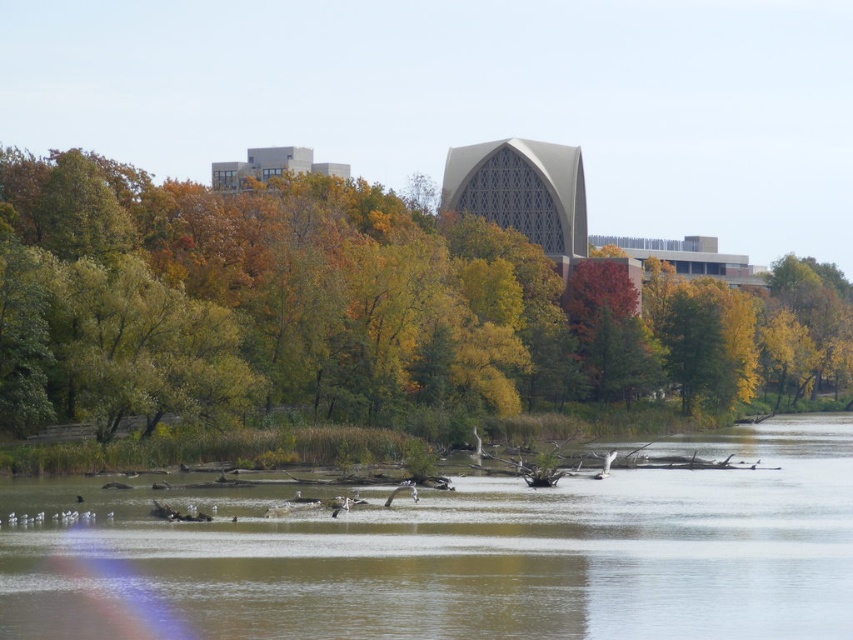
Question: Does green leafy tree at center appear on the left side of brown muddy water at center?

Choices:
 (A) yes
 (B) no

Answer: (B)

Question: From the image, what is the correct spatial relationship of green leafy tree at center in relation to brown muddy water at center?

Choices:
 (A) below
 (B) above

Answer: (B)

Question: Does green leafy tree at center appear on the left side of brown muddy water at center?

Choices:
 (A) yes
 (B) no

Answer: (B)

Question: Among these points, which one is farthest from the camera?

Choices:
 (A) (666, 634)
 (B) (480, 348)

Answer: (B)

Question: Which point is farther from the camera taking this photo?

Choices:
 (A) (848, 595)
 (B) (349, 227)

Answer: (B)

Question: Among these points, which one is farthest from the camera?

Choices:
 (A) (669, 595)
 (B) (560, 381)

Answer: (B)